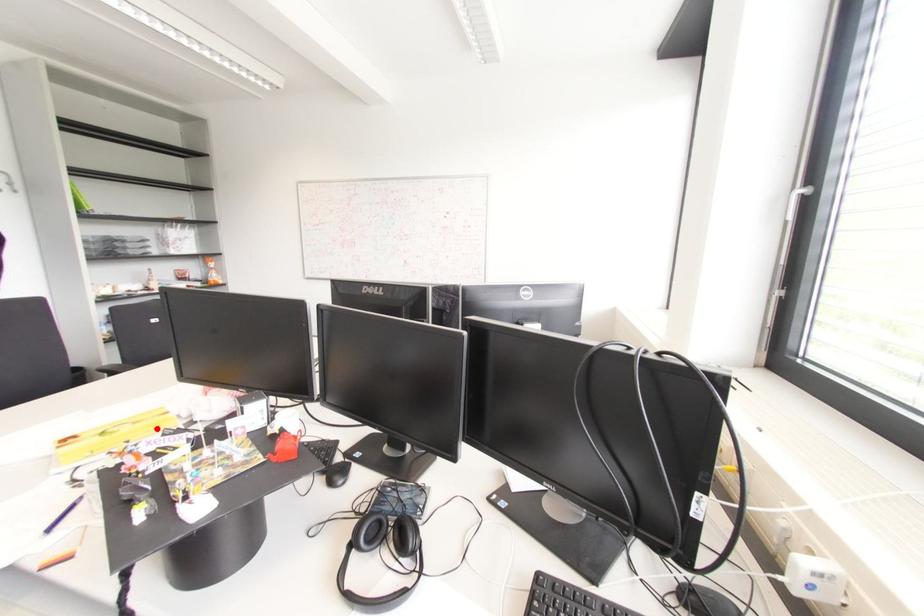
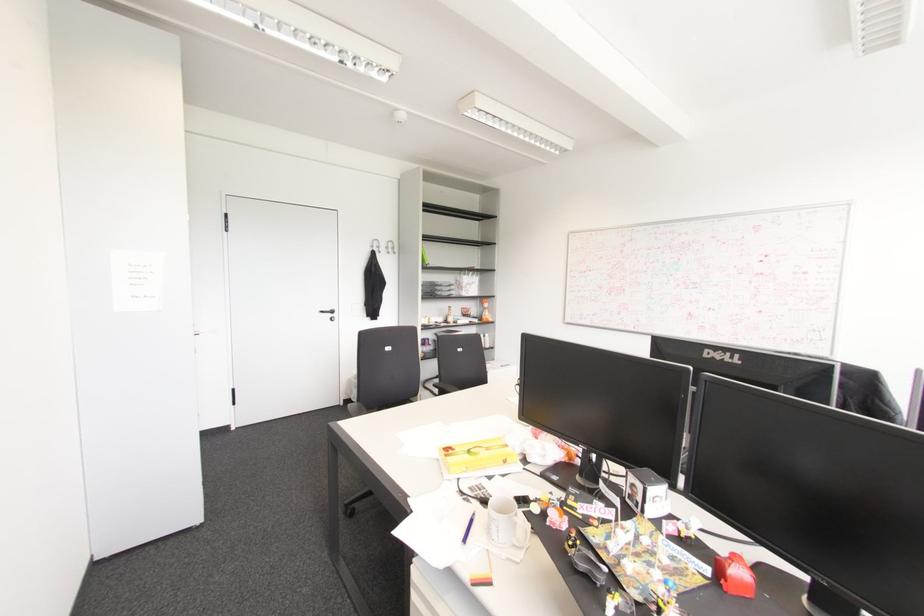
Question: A red point is marked in image1. In image2, is the corresponding 3D point closer to the camera or farther? Reply with the corresponding letter.

Choices:
 (A) The corresponding 3D point is closer.
 (B) The corresponding 3D point is farther.

Answer: (A)